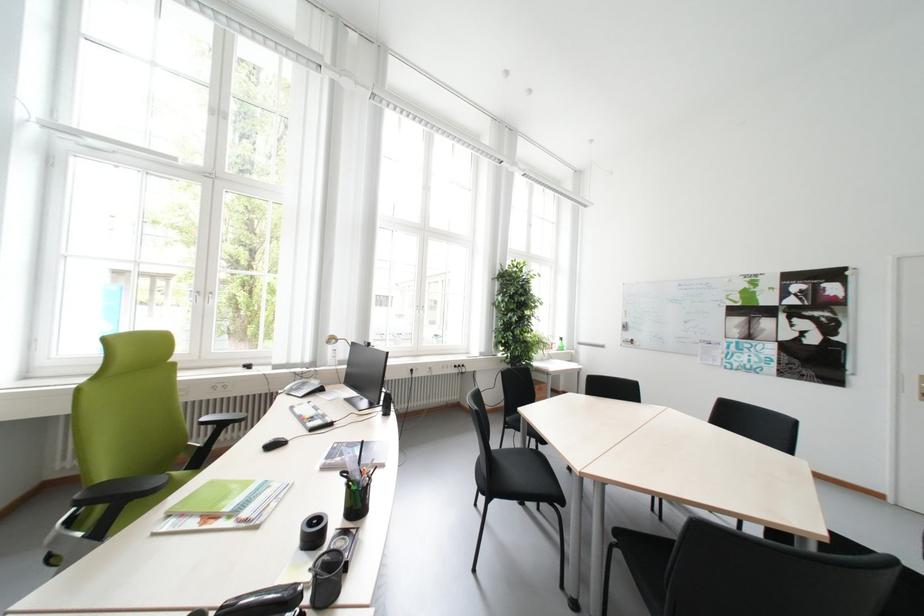
The location [274,444] corresponds to which object?

It refers to a black computer mouse.